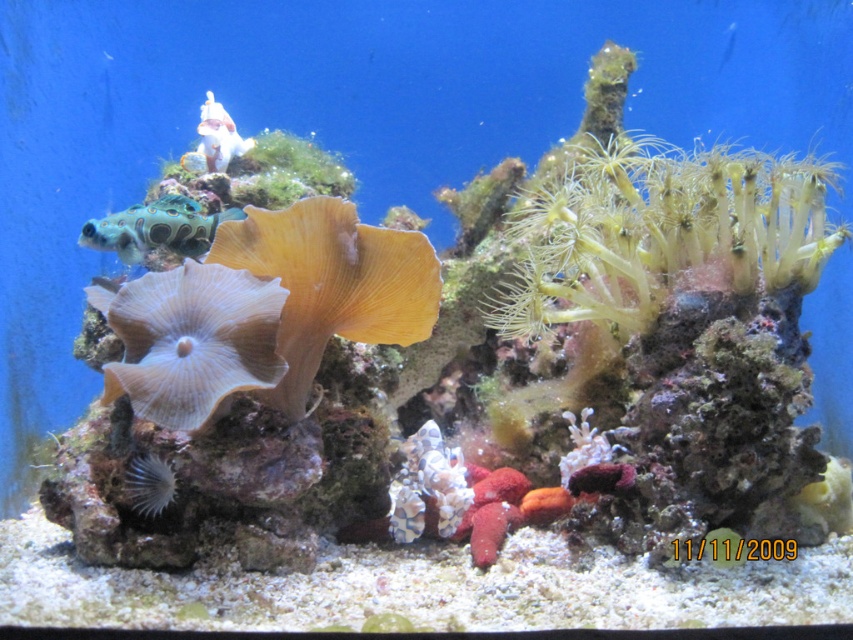
Between speckled shell at center and white glossy statue at upper center, which one is positioned lower?

speckled shell at center is below.

Does speckled shell at center appear on the right side of white glossy statue at upper center?

Correct, you'll find speckled shell at center to the right of white glossy statue at upper center.

Is point (396, 525) positioned in front of point (253, 144)?

Yes, it is in front of point (253, 144).

This screenshot has width=853, height=640. I want to click on speckled shell at center, so click(x=428, y=484).

Find the location of `white feathery marine at center`. white feathery marine at center is located at coordinates point(149,483).

Locate an element on the screen. white feathery marine at center is located at coordinates (149, 483).

Between green glossy pufferfish at upper left and white glossy statue at upper center, which one is positioned higher?

white glossy statue at upper center is above.

Does green glossy pufferfish at upper left lie behind white glossy statue at upper center?

No, it is not.

The image size is (853, 640). What are the coordinates of `green glossy pufferfish at upper left` in the screenshot? It's located at (155, 228).